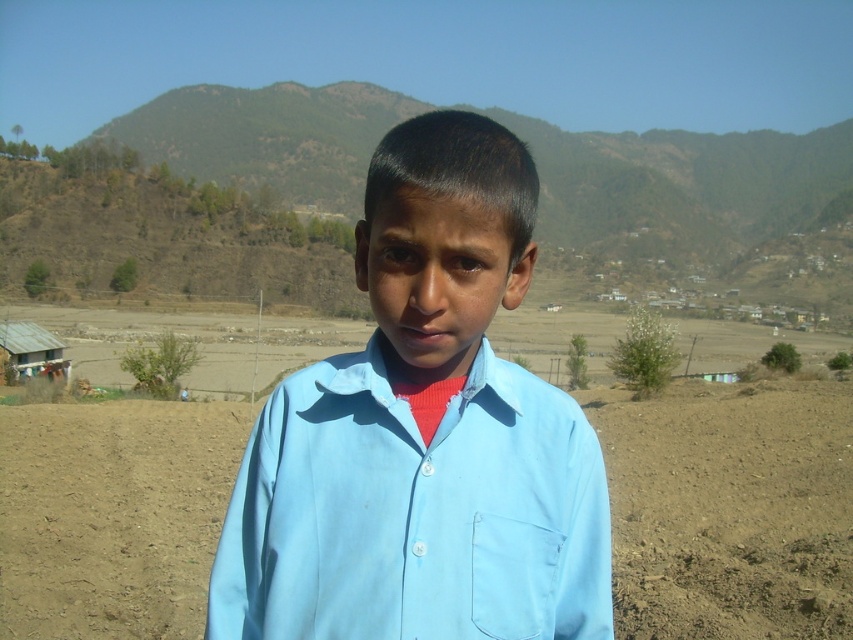
Based on the photo, does light blue cotton shirt at center appear over brown soil at center?

Yes, light blue cotton shirt at center is above brown soil at center.

Who is shorter, light blue cotton shirt at center or brown soil at center?

brown soil at center is shorter.

Describe the element at coordinates (422, 435) in the screenshot. I see `light blue cotton shirt at center` at that location.

This screenshot has height=640, width=853. Identify the location of light blue cotton shirt at center. (422, 435).